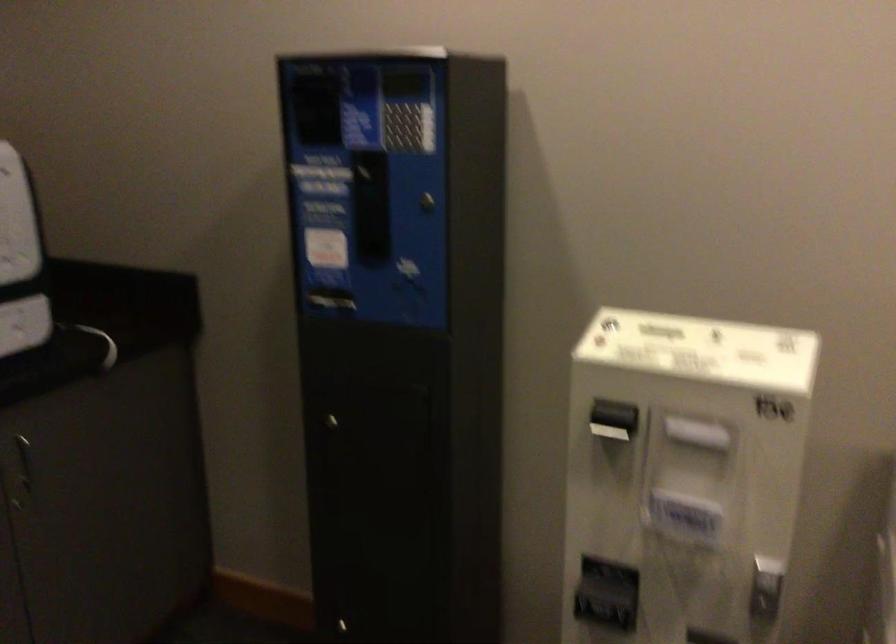
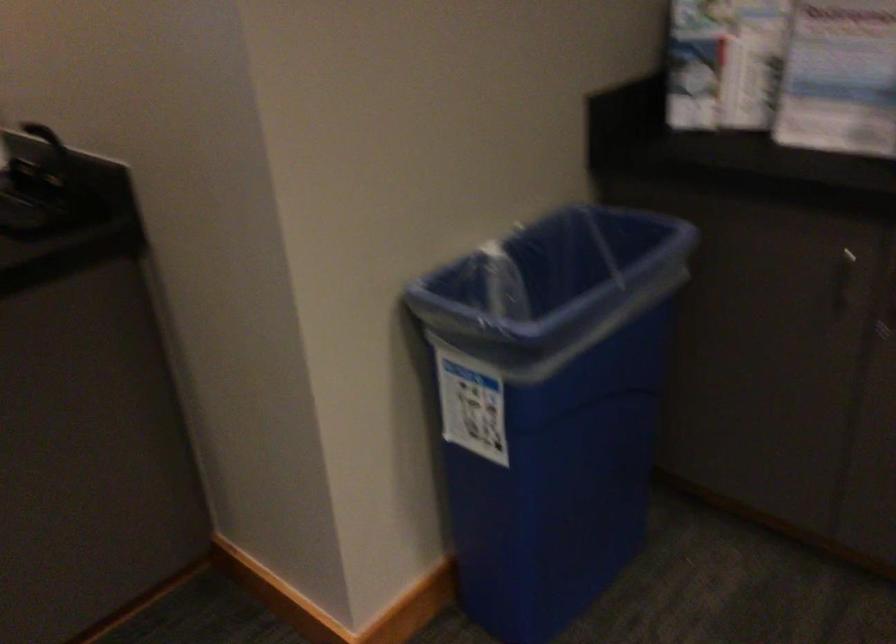
Looking at this image, first-person continuous shooting, in which direction is the camera rotating?

The rotation direction of the camera is left-down.